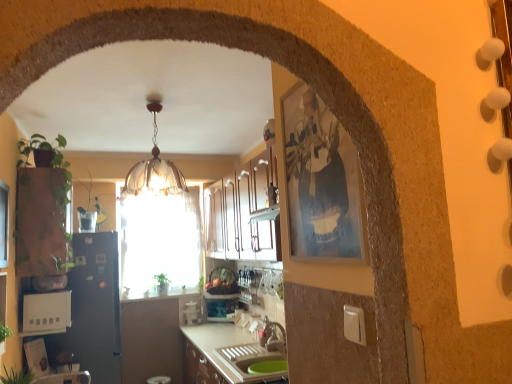
At what (x,y) coordinates should I click in order to perform the action: click on free point above translucent glass chandelier at center (from a real-world perspective). Please return your answer as a coordinate pair (x, y). Looking at the image, I should click on (152, 101).